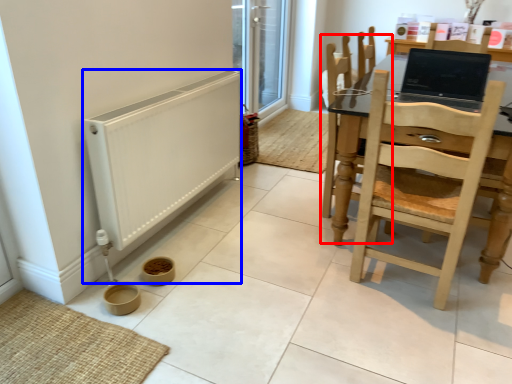
Question: Which point is further to the camera, chair (highlighted by a red box) or heater (highlighted by a blue box)?

Choices:
 (A) chair
 (B) heater

Answer: (A)